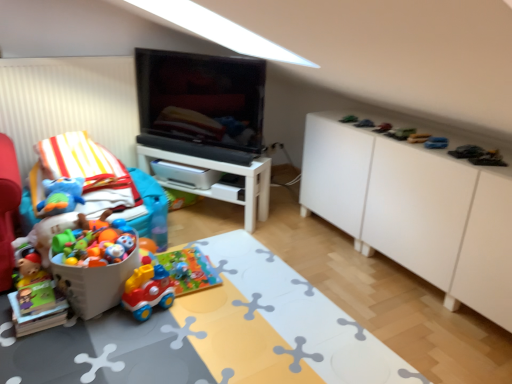
Question: Is black glossy tv at center positioned in front of white glossy table at center, positioned as the 2th table in bottom-to-top order?

Choices:
 (A) yes
 (B) no

Answer: (A)

Question: From the image's perspective, would you say black glossy tv at center is positioned over white glossy table at center, positioned as the 2th table in bottom-to-top order?

Choices:
 (A) no
 (B) yes

Answer: (B)

Question: Is black glossy tv at center positioned behind white glossy table at center, positioned as the 1th table in back-to-front order?

Choices:
 (A) yes
 (B) no

Answer: (B)

Question: Considering the relative positions of black glossy tv at center and white glossy table at center, positioned as the 1th table in top-to-bottom order, in the image provided, is black glossy tv at center to the left of white glossy table at center, positioned as the 1th table in top-to-bottom order, from the viewer's perspective?

Choices:
 (A) yes
 (B) no

Answer: (B)

Question: From a real-world perspective, is black glossy tv at center located higher than white glossy table at center, positioned as the 2th table in bottom-to-top order?

Choices:
 (A) no
 (B) yes

Answer: (B)

Question: Considering the relative positions of black glossy tv at center and white glossy table at center, positioned as the 2th table in bottom-to-top order, in the image provided, is black glossy tv at center to the right of white glossy table at center, positioned as the 2th table in bottom-to-top order, from the viewer's perspective?

Choices:
 (A) no
 (B) yes

Answer: (B)

Question: Is white glossy table at center, which appears as the 2th table when viewed from the top, positioned with its back to metallic silver toy car at upper right, which is the sixth toy in right-to-left order?

Choices:
 (A) yes
 (B) no

Answer: (B)

Question: Is white glossy table at center, the second table viewed from the back, wider than metallic silver toy car at upper right, positioned as the sixth toy in left-to-right order?

Choices:
 (A) no
 (B) yes

Answer: (B)

Question: From a real-world perspective, is white glossy table at center, which appears as the 2th table when viewed from the top, on top of metallic silver toy car at upper right, which is the sixth toy in right-to-left order?

Choices:
 (A) no
 (B) yes

Answer: (A)

Question: Considering the relative sizes of white glossy table at center, the 1th table in the bottom-to-top sequence, and metallic silver toy car at upper right, which is the sixth toy in right-to-left order, in the image provided, is white glossy table at center, the 1th table in the bottom-to-top sequence, thinner than metallic silver toy car at upper right, which is the sixth toy in right-to-left order,?

Choices:
 (A) yes
 (B) no

Answer: (B)

Question: Does white glossy table at center, the second table viewed from the back, have a greater height compared to metallic silver toy car at upper right, which is the sixth toy in right-to-left order?

Choices:
 (A) yes
 (B) no

Answer: (A)

Question: Would you say white glossy table at center, which appears as the 2th table when viewed from the top, is a long distance from metallic silver toy car at upper right, which is the sixth toy in right-to-left order?

Choices:
 (A) no
 (B) yes

Answer: (B)

Question: Is black glossy tv at center next to white plastic bucket at lower left and touching it?

Choices:
 (A) no
 (B) yes

Answer: (A)